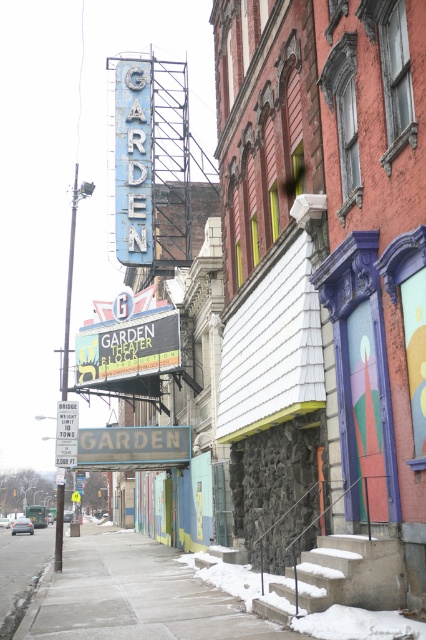
Can you confirm if blue metallic sign at center is taller than metallic reflective parking sign at center?

Yes.

Is blue metallic sign at center below metallic reflective parking sign at center?

Correct, blue metallic sign at center is located below metallic reflective parking sign at center.

The height and width of the screenshot is (640, 426). Identify the location of blue metallic sign at center. (132, 445).

Is concrete sidewalk at lower center above metallic reflective parking sign at center?

No.

You are a GUI agent. You are given a task and a screenshot of the screen. Output one action in this format:
    pyautogui.click(x=<x>, y=<y>)
    Task: Click on the concrete sidewalk at lower center
    
    Given the screenshot: What is the action you would take?
    pyautogui.click(x=135, y=596)

The height and width of the screenshot is (640, 426). What are the coordinates of `concrete sidewalk at lower center` in the screenshot? It's located at (135, 596).

Is point (118, 563) farther from viewer compared to point (115, 456)?

No, (118, 563) is in front of (115, 456).

Can you confirm if concrete sidewalk at lower center is positioned below blue metallic sign at center?

Yes, concrete sidewalk at lower center is below blue metallic sign at center.

What do you see at coordinates (135, 596) in the screenshot? This screenshot has height=640, width=426. I see `concrete sidewalk at lower center` at bounding box center [135, 596].

This screenshot has width=426, height=640. What are the coordinates of `concrete sidewalk at lower center` in the screenshot? It's located at (135, 596).